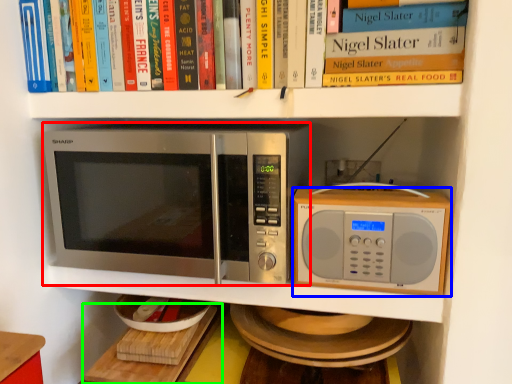
Question: Estimate the real-world distances between objects in this image. Which object is farther from microwave oven (highlighted by a red box), microwave oven (highlighted by a blue box) or table (highlighted by a green box)?

Choices:
 (A) microwave oven
 (B) table

Answer: (B)